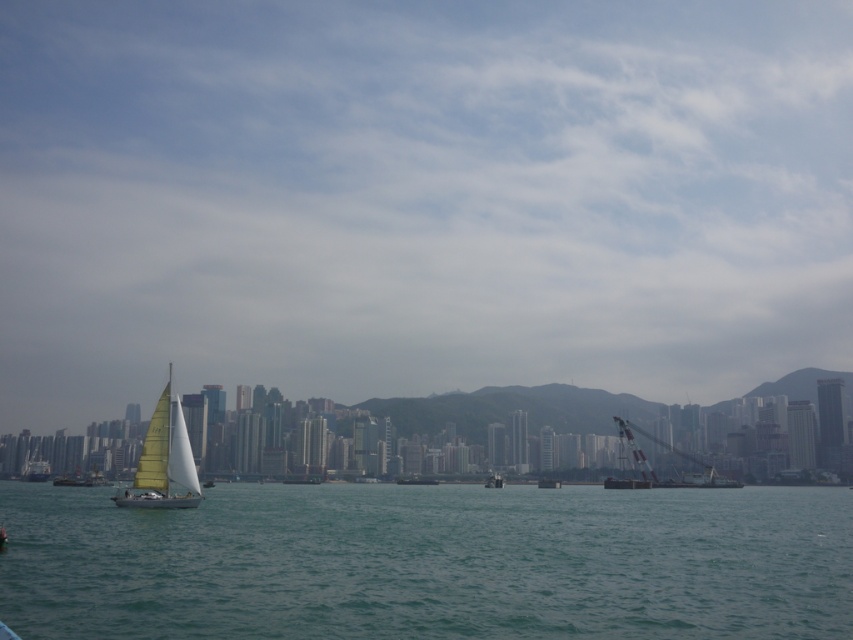
Question: Estimate the real-world distances between objects in this image. Which object is closer to the transparent glass sailboat at lower left?

Choices:
 (A) yellow matte sailboat at left
 (B) metallic gray boat at center
 (C) white plastic crane at right
 (D) green water at lower left

Answer: (C)

Question: Does yellow matte sailboat at left have a lesser width compared to metallic gray boat at center?

Choices:
 (A) no
 (B) yes

Answer: (B)

Question: Does yellow matte sailboat at left appear on the right side of white plastic crane at right?

Choices:
 (A) no
 (B) yes

Answer: (A)

Question: Considering the relative positions of white plastic crane at right and metallic gray boat at center in the image provided, where is white plastic crane at right located with respect to metallic gray boat at center?

Choices:
 (A) left
 (B) right

Answer: (B)

Question: Which is farther from the yellow matte sailboat at left?

Choices:
 (A) metallic gray boat at center
 (B) green water at lower left

Answer: (A)

Question: Which is nearer to the metallic gray boat at center?

Choices:
 (A) transparent glass sailboat at lower left
 (B) green water at lower left
 (C) yellow matte sailboat at left

Answer: (B)